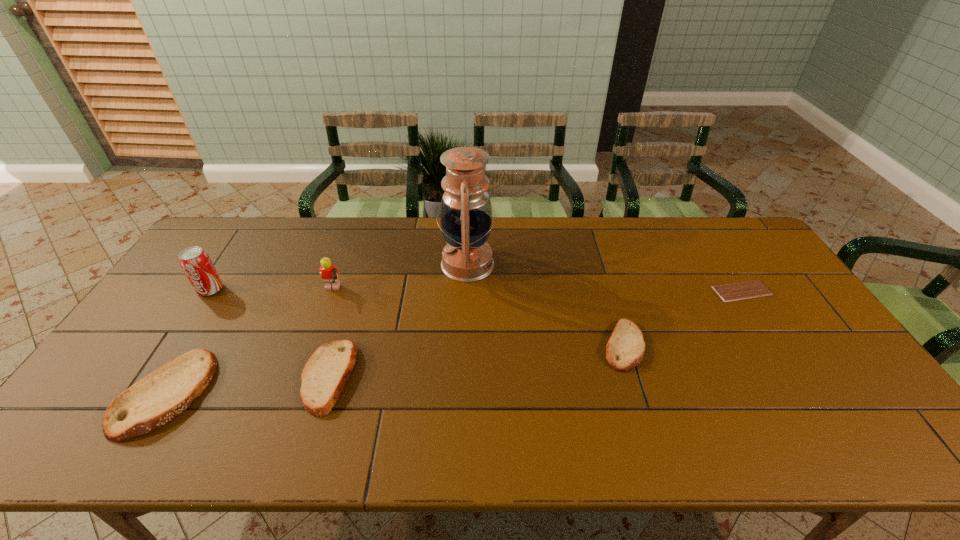
If equal spacing is the goal by inserting an additional pita_(bread) among them, please point out a vacant space for this new pita_(bread). Please provide its 2D coordinates. Your answer should be formatted as a tuple, i.e. [(x, y)], where the tuple contains the x and y coordinates of a point satisfying the conditions above.

[(481, 360)]